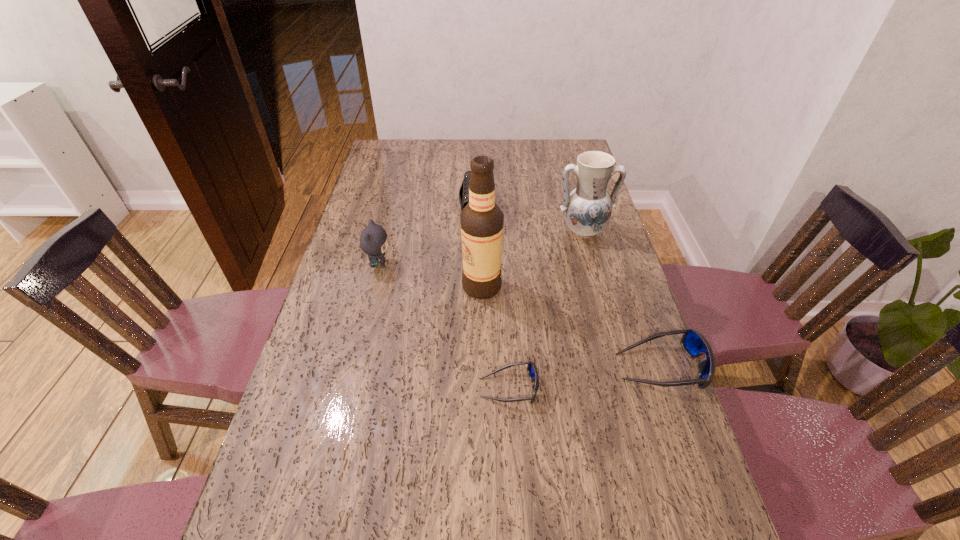
With all sunglassess evenly spaced, where should an extra sunglasses be placed on the left to continue the pattern? Please point out a vacant space. Please provide its 2D coordinates. Your answer should be formatted as a tuple, i.e. [(x, y)], where the tuple contains the x and y coordinates of a point satisfying the conditions above.

[(345, 411)]